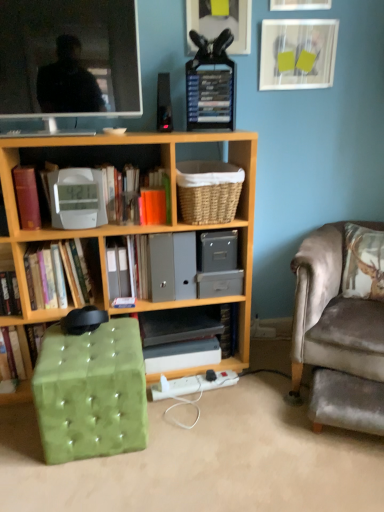
Where is `empty space that is to the right of white plastic charger at lower center`? empty space that is to the right of white plastic charger at lower center is located at coordinates (257, 391).